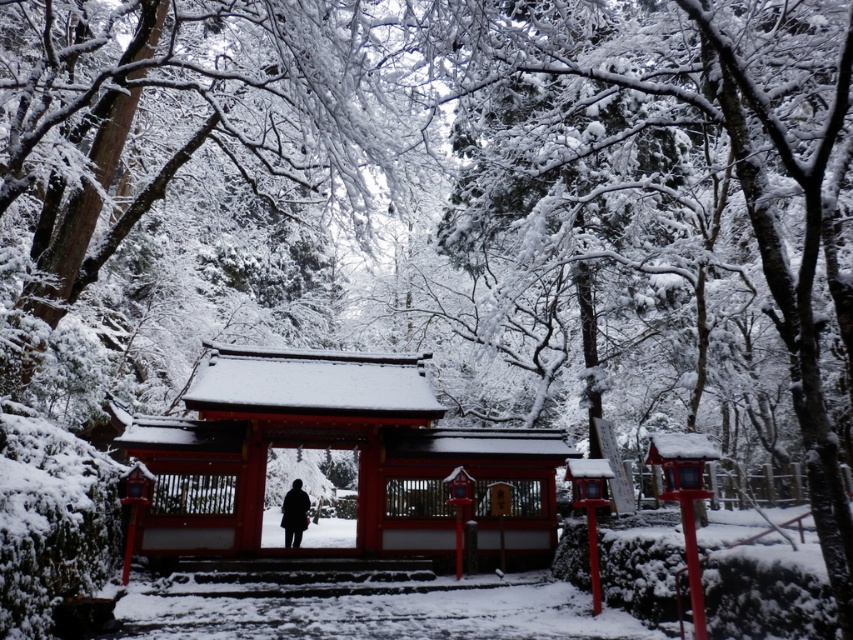
The height and width of the screenshot is (640, 853). What do you see at coordinates (334, 449) in the screenshot?
I see `shiny lacquered shrine gate at center` at bounding box center [334, 449].

Is point (461, 436) positioned after point (292, 481)?

That is False.

Where is `shiny lacquered shrine gate at center`? shiny lacquered shrine gate at center is located at coordinates (334, 449).